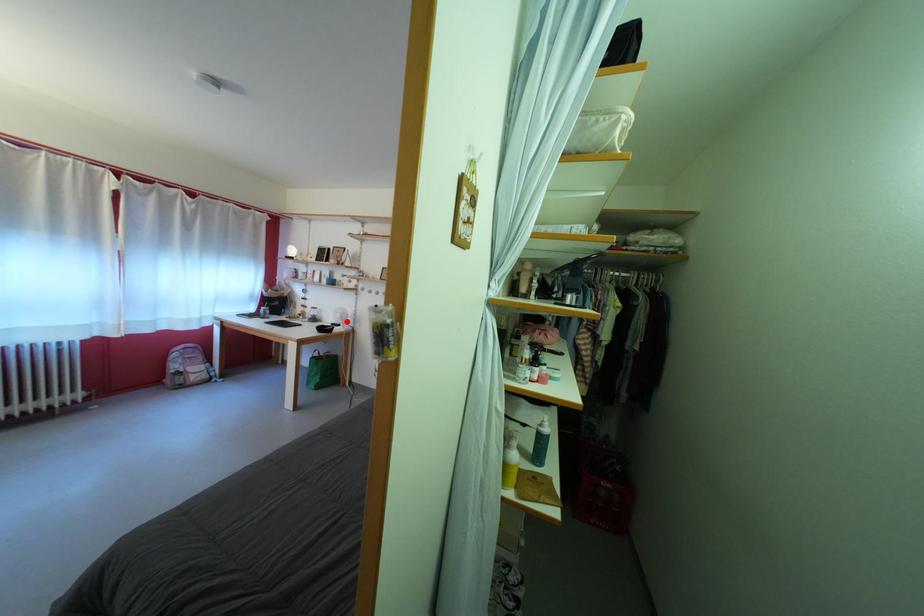
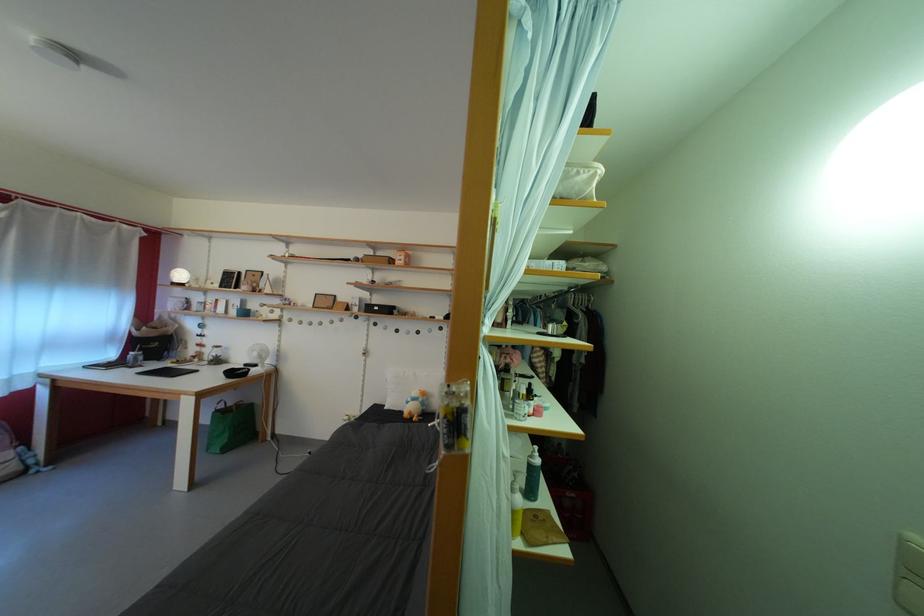
Question: A red point is marked in image1. In image2, is the corresponding 3D point closer to the camera or farther? Reply with the corresponding letter.

Choices:
 (A) The corresponding 3D point is closer.
 (B) The corresponding 3D point is farther.

Answer: (A)